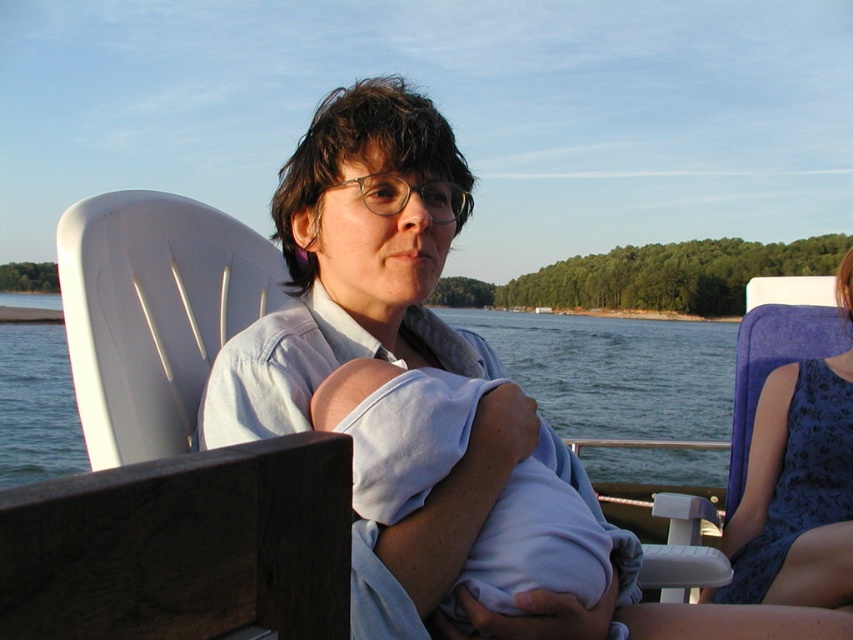
Please describe the location of the point labeled as point [352,260] in the scene.

The point labeled as point [352,260] is located at the center of the matte blue shirt at center.

You are an artist planning to paint this scene. You want to ensure the proportions of the matte blue shirt at center and the blue lace dress at right match the actual sizes. Which one should you paint larger?

The matte blue shirt at center should be painted larger since it is bigger than the blue lace dress at right according to the description.

You are standing in the serene outdoor scene and want to place a small decoration between the two points, point 1 at (273, 196) and point 2 at (830, 477). Which point should you place it closer to in order to make it more visible to someone looking from your current position?

You should place the decoration closer to point 1 at (273, 196) because it is closer to the viewer, making it more visible from your current position.